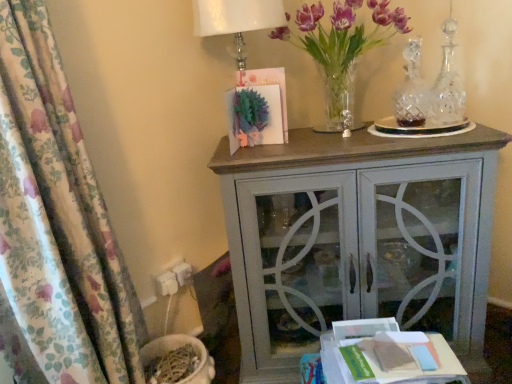
Question: Considering the positions of matte gray cabinet at center and white paper at lower right in the image, is matte gray cabinet at center wider or thinner than white paper at lower right?

Choices:
 (A) thin
 (B) wide

Answer: (B)

Question: Considering the relative positions of matte gray cabinet at center and white paper at lower right in the image provided, is matte gray cabinet at center to the left or to the right of white paper at lower right?

Choices:
 (A) right
 (B) left

Answer: (B)

Question: Which object is the farthest from the floral fabric curtain at left?

Choices:
 (A) purple glass vase at upper right
 (B) white paper at lower right
 (C) matte gray cabinet at center

Answer: (A)

Question: Considering the real-world distances, which object is closest to the matte gray cabinet at center?

Choices:
 (A) purple glass vase at upper right
 (B) floral fabric curtain at left
 (C) white paper at lower right

Answer: (C)